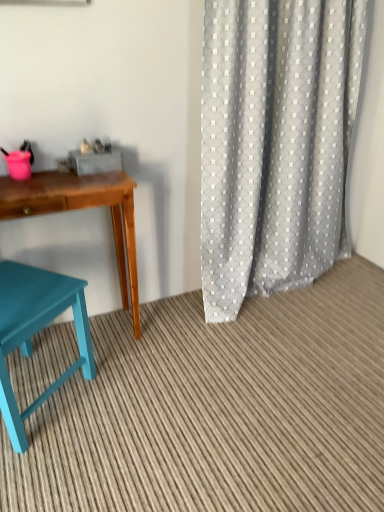
The image size is (384, 512). I want to click on vacant area to the right of teal wood desk at left, so click(x=166, y=353).